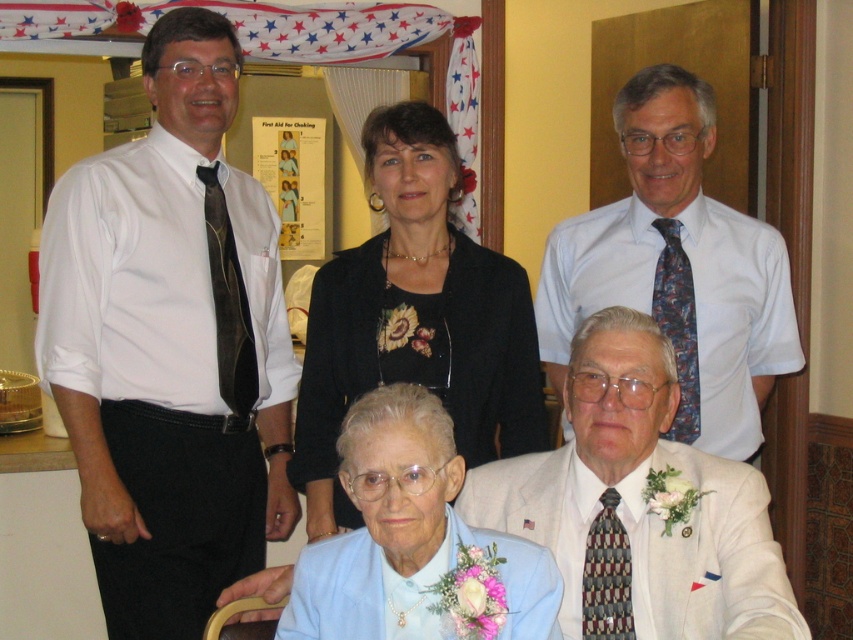
Question: Which of these objects is positioned closest to the multicolored woven tie at lower right?

Choices:
 (A) black fabric at upper center
 (B) light blue fabric at lower center
 (C) white textured suit at lower right
 (D) brown textured tie at left

Answer: (C)

Question: Which point is farther from the camera taking this photo?

Choices:
 (A) (666, 241)
 (B) (434, 634)

Answer: (A)

Question: Is white shirt at upper right positioned at the back of brown textured tie at left?

Choices:
 (A) no
 (B) yes

Answer: (A)

Question: Observing the image, what is the correct spatial positioning of white shirt at left in reference to white shirt at upper right?

Choices:
 (A) right
 (B) left

Answer: (B)

Question: Which point appears farthest from the camera in this image?

Choices:
 (A) (679, 310)
 (B) (587, 582)
 (C) (131, 637)
 (D) (525, 618)

Answer: (A)

Question: From the image, what is the correct spatial relationship of white shirt at left in relation to multicolored woven tie at lower right?

Choices:
 (A) left
 (B) right

Answer: (A)